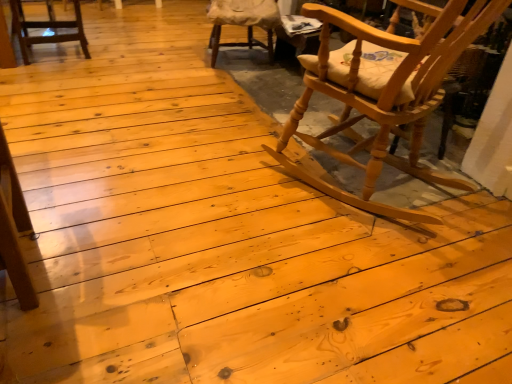
Locate an element on the screen. free spot below natural wood rocking chair at right, which is the third chair from left to right (from a real-world perspective) is located at coordinates (360, 178).